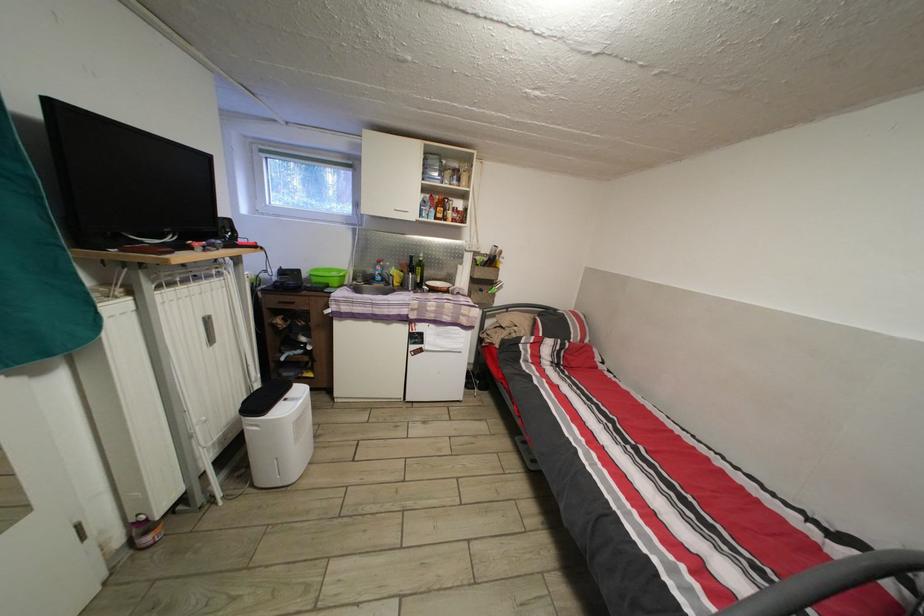
This screenshot has width=924, height=616. In order to click on clear food container in this screenshot , I will do `click(327, 276)`.